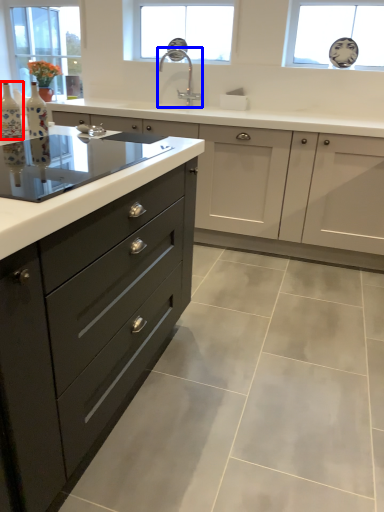
Question: Which object is further to the camera taking this photo, bottle (highlighted by a red box) or sink (highlighted by a blue box)?

Choices:
 (A) bottle
 (B) sink

Answer: (B)